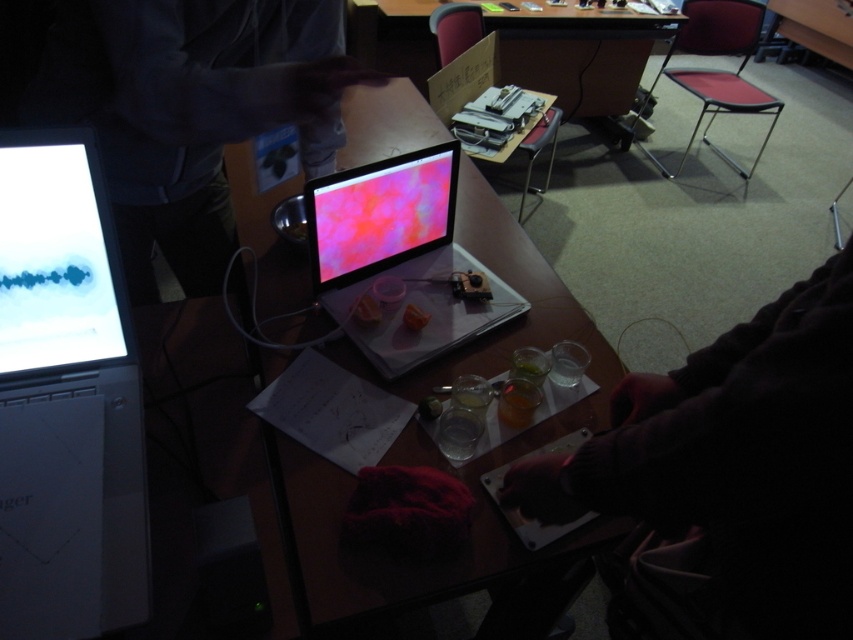
You are a researcher in a lab and need to place a 15 cm wide beaker on the table. The beaker must be placed at point (67, 403). However, there is an object already at that point. What object is blocking the placement of the beaker?

The white glossy laptop at left is blocking the placement of the beaker at point (67, 403).

You are organizing the workspace and need to stack the shiny plastic laptop at center and the matte plastic laptop at center vertically. Which one should you place at the bottom to ensure stability?

The shiny plastic laptop at center is taller than the matte plastic laptop at center, so placing the taller laptop at the bottom would provide a more stable base.